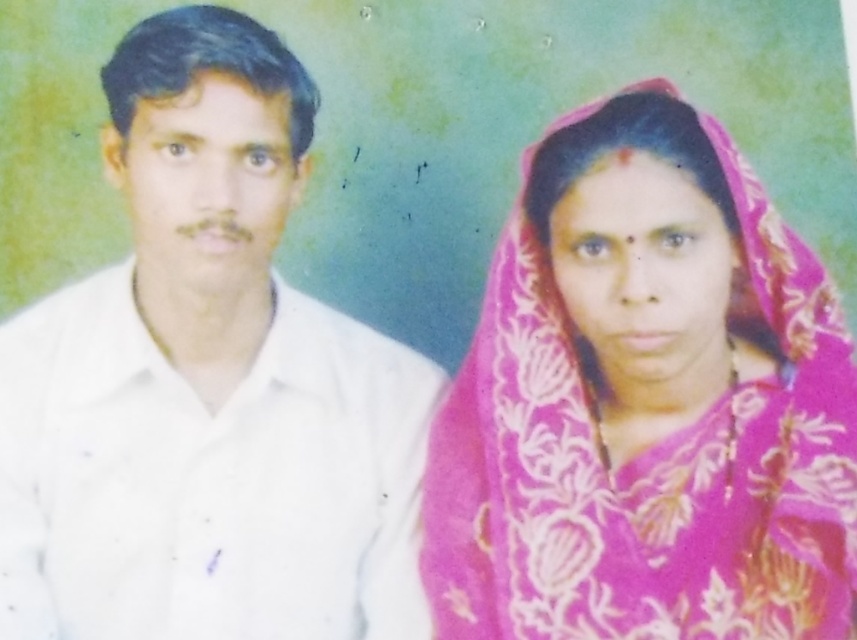
Question: Does white cotton shirt at left come behind pink floral fabric shawl at right?

Choices:
 (A) yes
 (B) no

Answer: (A)

Question: Which object is closer to the camera taking this photo?

Choices:
 (A) pink floral fabric shawl at right
 (B) white cotton shirt at left

Answer: (A)

Question: Can you confirm if white cotton shirt at left is wider than pink floral fabric shawl at right?

Choices:
 (A) yes
 (B) no

Answer: (A)

Question: Does white cotton shirt at left have a larger size compared to pink floral fabric shawl at right?

Choices:
 (A) yes
 (B) no

Answer: (A)

Question: Which object is farther from the camera taking this photo?

Choices:
 (A) pink floral fabric shawl at right
 (B) white cotton shirt at left

Answer: (B)